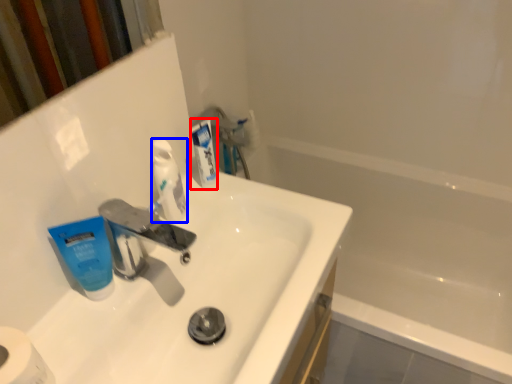
Question: Which object is further to the camera taking this photo, toothpaste (highlighted by a red box) or toothpaste (highlighted by a blue box)?

Choices:
 (A) toothpaste
 (B) toothpaste

Answer: (A)